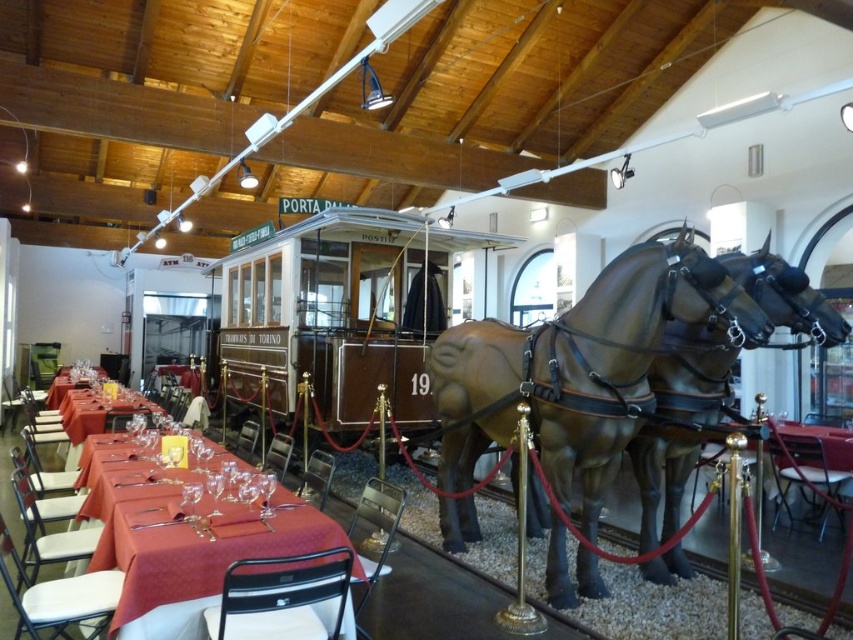
Question: Is brown polished wood train car at center below shiny glassware at center?

Choices:
 (A) yes
 (B) no

Answer: (B)

Question: Is shiny brown horse at center below matte red tablecloth at center?

Choices:
 (A) no
 (B) yes

Answer: (A)

Question: Which point is farther to the camera?

Choices:
 (A) (67, 404)
 (B) (634, 300)
 (C) (49, 406)

Answer: (C)

Question: Which object is positioned farthest from the shiny brown horse at center?

Choices:
 (A) matte red tablecloth at left
 (B) brown polished wood train car at center
 (C) matte red tablecloth at center

Answer: (A)

Question: Can you confirm if matte red tablecloth at center is wider than matte red tablecloth at left?

Choices:
 (A) yes
 (B) no

Answer: (A)

Question: Which of the following is the farthest from the observer?

Choices:
 (A) (102, 416)
 (B) (286, 380)

Answer: (B)